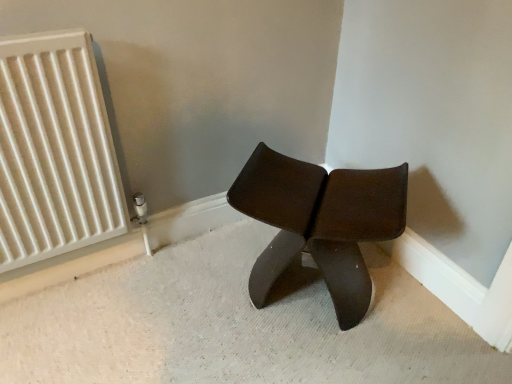
Image resolution: width=512 pixels, height=384 pixels. I want to click on free spot in front of white matte radiator at left, so click(73, 326).